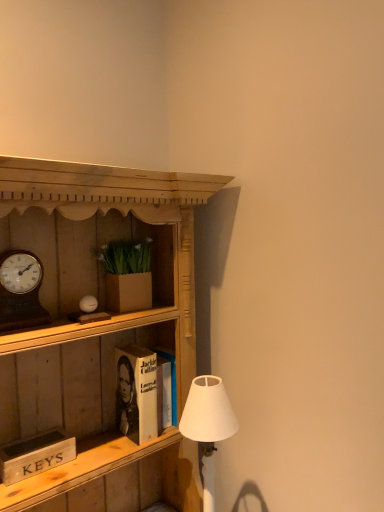
Question: Would you say wooden signboard at lower left, positioned as the 2th book in right-to-left order, is inside or outside brown cardboard box at upper center?

Choices:
 (A) inside
 (B) outside

Answer: (B)

Question: From the image's perspective, is wooden signboard at lower left, the 1th book when ordered from left to right, positioned above or below brown cardboard box at upper center?

Choices:
 (A) below
 (B) above

Answer: (A)

Question: Estimate the real-world distances between objects in this image. Which object is farther from the wooden signboard at lower left, which is the second book from back to front?

Choices:
 (A) brown cardboard box at upper center
 (B) wooden cabinet at center
 (C) hardcover book at center, which is counted as the first book, starting from the back
 (D) white matte lampshade at lower right
 (E) wooden clock at left

Answer: (A)

Question: Based on their relative distances, which object is farther from the wooden clock at left?

Choices:
 (A) wooden signboard at lower left, which is the second book from back to front
 (B) white matte lampshade at lower right
 (C) brown cardboard box at upper center
 (D) hardcover book at center, arranged as the second book when viewed from the front
 (E) wooden cabinet at center

Answer: (B)